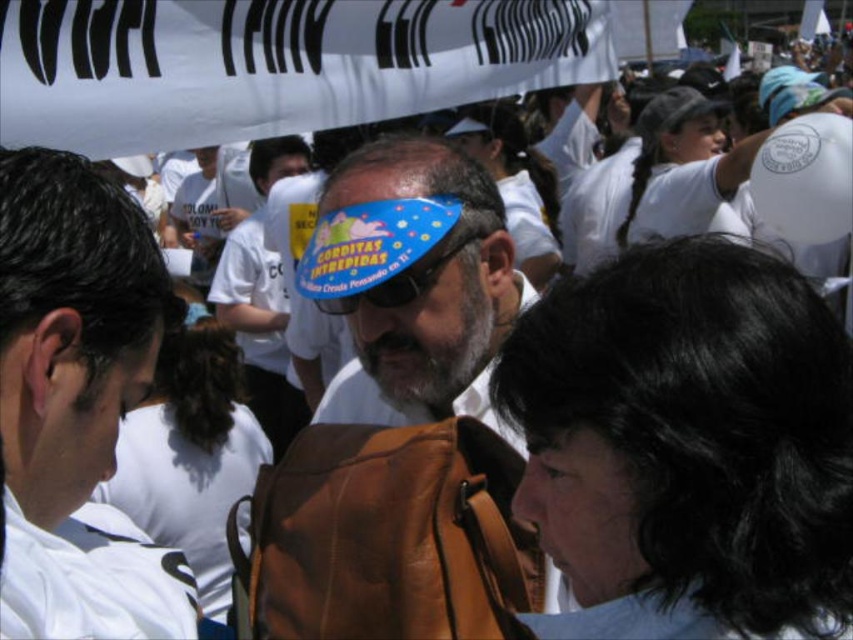
Consider the image. You are a photographer at the event and want to capture a photo of the man with the blue hat and the blue paper mask at center. Based on their positions, will the mask be visible in the photo if you focus on the man?

The blue paper mask at center is located at point (413, 284), which is at the center of the image. Since the man with the blue hat is in the foreground and the mask is centrally positioned, the mask should be visible in the photo when focusing on the man.